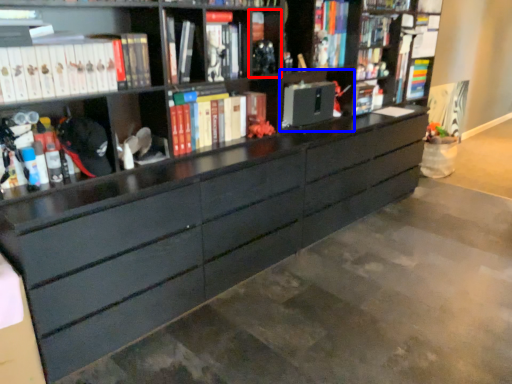
Question: Which object appears farthest to the camera in this image, cabinet (highlighted by a red box) or cabinet (highlighted by a blue box)?

Choices:
 (A) cabinet
 (B) cabinet

Answer: (B)